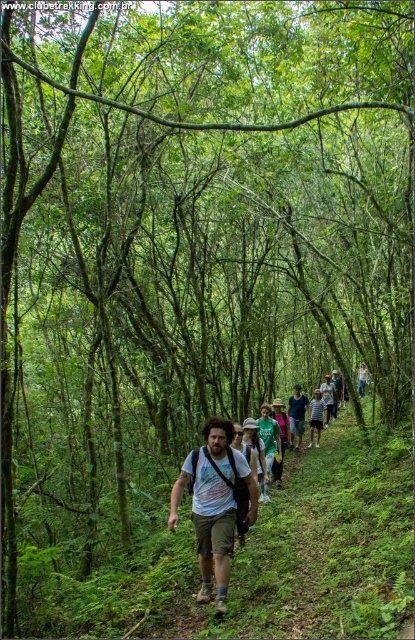
Can you confirm if light brown cotton shorts at center is positioned to the right of light blue cotton shirt at center?

No, light brown cotton shorts at center is not to the right of light blue cotton shirt at center.

Does light brown cotton shorts at center have a lesser width compared to light blue cotton shirt at center?

No.

Measure the distance between point (221, 493) and camera.

Point (221, 493) is 19.42 feet away from camera.

This screenshot has width=415, height=640. What are the coordinates of `light brown cotton shorts at center` in the screenshot? It's located at (214, 504).